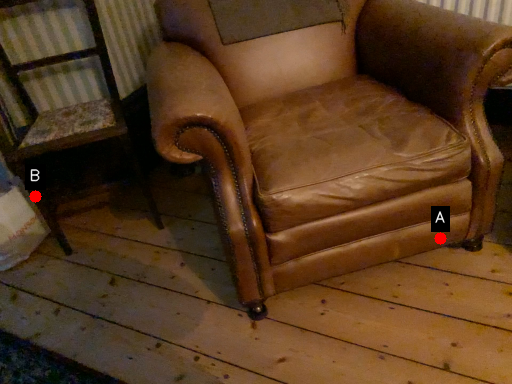
Question: Two points are circled on the image, labeled by A and B beside each circle. Which of the following is the farthest from the observer?

Choices:
 (A) A is further
 (B) B is further

Answer: (B)